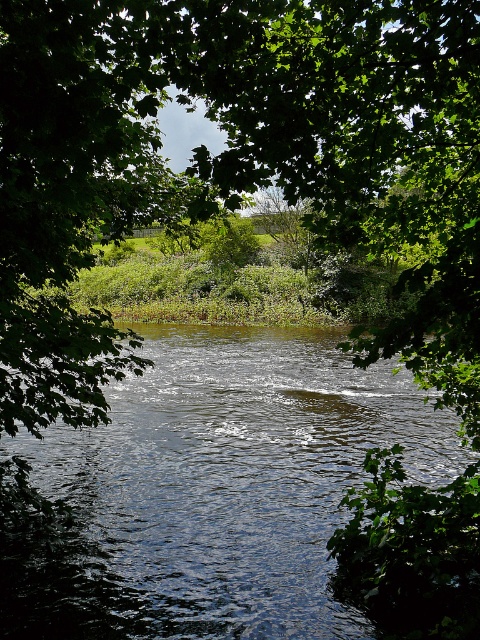
Question: Is the position of green leafy tree at center less distant than that of dark blue water at center?

Choices:
 (A) yes
 (B) no

Answer: (A)

Question: Which point appears closest to the camera in this image?

Choices:
 (A) (19, 317)
 (B) (288, 568)

Answer: (A)

Question: Is green leafy tree at center to the left of dark blue water at center from the viewer's perspective?

Choices:
 (A) yes
 (B) no

Answer: (A)

Question: Which of the following is the closest to the observer?

Choices:
 (A) green leafy tree at center
 (B) dark blue water at center

Answer: (A)

Question: Is green leafy tree at center below dark blue water at center?

Choices:
 (A) no
 (B) yes

Answer: (A)

Question: Which point appears closest to the camera in this image?

Choices:
 (A) (235, 556)
 (B) (269, 92)

Answer: (B)